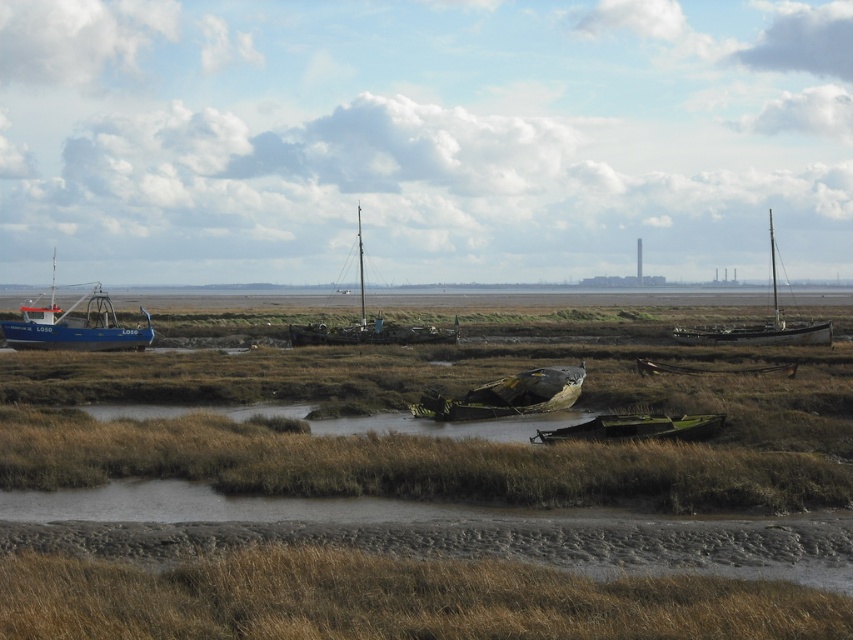
Question: Does brown dry grass at lower center have a greater width compared to rusty metal boat at center?

Choices:
 (A) yes
 (B) no

Answer: (A)

Question: Among these points, which one is farthest from the camera?

Choices:
 (A) (648, 608)
 (B) (21, 330)
 (C) (809, 328)

Answer: (B)

Question: Among these objects, which one is nearest to the camera?

Choices:
 (A) wooden sailboat at right
 (B) brown dry grass at center

Answer: (B)

Question: Is brown dry grass at center to the left of rusty metal boat at center from the viewer's perspective?

Choices:
 (A) no
 (B) yes

Answer: (B)

Question: Which of the following is the farthest from the observer?

Choices:
 (A) wooden sailboat at center
 (B) green matte boat at center
 (C) blue painted wooden boat at left

Answer: (A)

Question: In this image, where is wooden sailboat at center located relative to wooden sailboat at right?

Choices:
 (A) below
 (B) above

Answer: (B)